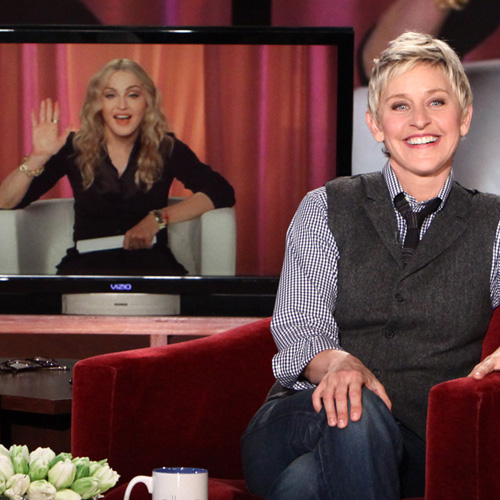
You are a GUI agent. You are given a task and a screenshot of the screen. Output one action in this format:
    pyautogui.click(x=<x>, y=<y>)
    Task: Click on the white and blue coffee mug
    
    Given the screenshot: What is the action you would take?
    pyautogui.click(x=167, y=484)